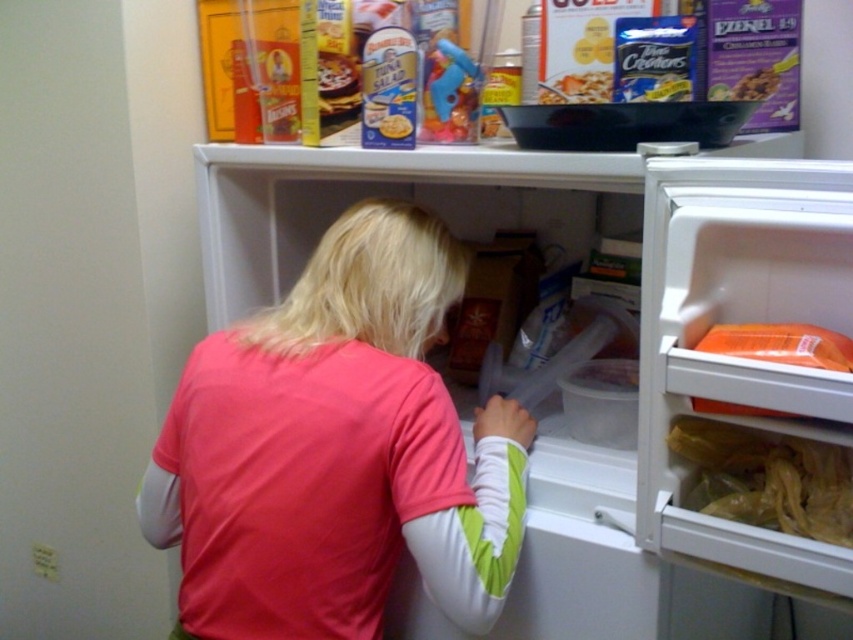
Question: Is white plastic fridge at center below pink fabric shirt at center?

Choices:
 (A) yes
 (B) no

Answer: (A)

Question: Can you confirm if pink fabric shirt at center is positioned below matte plastic bowl at upper center?

Choices:
 (A) no
 (B) yes

Answer: (B)

Question: Among these objects, which one is nearest to the camera?

Choices:
 (A) pink fabric shirt at center
 (B) matte plastic bowl at upper center
 (C) white plastic fridge at center

Answer: (C)

Question: Among these points, which one is nearest to the camera?

Choices:
 (A) (376, 298)
 (B) (730, 513)
 (C) (828, 438)
 (D) (553, 81)

Answer: (C)

Question: Among these objects, which one is farthest from the camera?

Choices:
 (A) white plastic fridge at center
 (B) translucent plastic bag at lower right

Answer: (B)

Question: Does white plastic fridge at center have a larger size compared to matte plastic bowl at upper center?

Choices:
 (A) yes
 (B) no

Answer: (A)